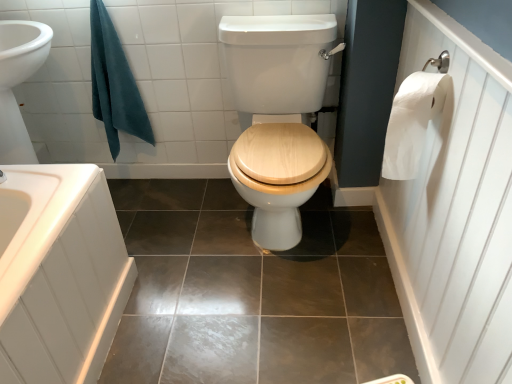
In order to face shiny brown tile at center, should I rotate leftwards or rightwards?

A 4.772 degree turn to the left will do.

The height and width of the screenshot is (384, 512). I want to click on white paper towel at right, so click(455, 211).

Describe the element at coordinates (455, 211) in the screenshot. I see `white paper towel at right` at that location.

You are a GUI agent. You are given a task and a screenshot of the screen. Output one action in this format:
    pyautogui.click(x=<x>, y=<y>)
    Task: Click on the shiny brown tile at center
    The width and height of the screenshot is (512, 384).
    Given the screenshot: What is the action you would take?
    pyautogui.click(x=251, y=293)

Is white paper towel at right facing towards shiny brown tile at center?

Yes.

Considering the sizes of objects white paper towel at right and shiny brown tile at center in the image provided, who is taller, white paper towel at right or shiny brown tile at center?

white paper towel at right is taller.

This screenshot has width=512, height=384. Identify the location of ceramic tile below the white paper towel at right (from the image's perspective). (251, 293).

Considering the points (446, 343) and (332, 325), which point is behind, point (446, 343) or point (332, 325)?

The point (332, 325) is farther from the camera.

What's the angular difference between white paper towel at right and teal cotton towel at upper left's facing directions?

90 degrees separate the facing orientations of white paper towel at right and teal cotton towel at upper left.

Considering the relative sizes of white paper towel at right and teal cotton towel at upper left in the image provided, is white paper towel at right taller than teal cotton towel at upper left?

Indeed, white paper towel at right has a greater height compared to teal cotton towel at upper left.

Measure the distance between white paper towel at right and teal cotton towel at upper left.

4.25 feet.

From the image's perspective, does white paper towel at right appear higher than teal cotton towel at upper left?

No.

Considering the sizes of objects teal cotton towel at upper left and shiny brown tile at center in the image provided, who is bigger, teal cotton towel at upper left or shiny brown tile at center?

shiny brown tile at center is bigger.

Considering the positions of points (117, 141) and (195, 197), is point (117, 141) closer to camera compared to point (195, 197)?

Yes, point (117, 141) is closer to viewer.

Does teal cotton towel at upper left touch shiny brown tile at center?

No, teal cotton towel at upper left is not touching shiny brown tile at center.

Is white wood toilet seat at center shorter than white paper at right?

No.

Is white wood toilet seat at center with white paper at right?

There is a gap between white wood toilet seat at center and white paper at right.

The image size is (512, 384). In order to click on toilet paper above the white wood toilet seat at center (from the image's perspective) in this screenshot , I will do `click(412, 123)`.

Is white wood toilet seat at center far from white paper towel at right?

No.

Between white wood toilet seat at center and white paper towel at right, which one is positioned in front?

Positioned in front is white paper towel at right.

Can you confirm if white wood toilet seat at center is thinner than white paper towel at right?

No.

How many degrees apart are the facing directions of white wood toilet seat at center and white paper towel at right?

90 degrees.

Considering the positions of objects white paper at right and teal cotton towel at upper left in the image provided, who is more to the left, white paper at right or teal cotton towel at upper left?

teal cotton towel at upper left is more to the left.

From a real-world perspective, between white paper at right and teal cotton towel at upper left, who is vertically higher?

white paper at right is physically above.

Is white paper at right next to teal cotton towel at upper left and touching it?

No, white paper at right is not touching teal cotton towel at upper left.

Is there a large distance between white wood toilet seat at center and shiny brown tile at center?

No.

Which is behind, point (255, 48) or point (138, 180)?

The point (138, 180) is more distant.

Is white wood toilet seat at center looking in the opposite direction of shiny brown tile at center?

white wood toilet seat at center is not turned away from shiny brown tile at center.

At what (x,y) coordinates should I click in order to perform the action: click on side in front of the shiny brown tile at center. Please return your answer as a coordinate pair (x, y). This screenshot has width=512, height=384. Looking at the image, I should click on (455, 211).

You are a GUI agent. You are given a task and a screenshot of the screen. Output one action in this format:
    pyautogui.click(x=<x>, y=<y>)
    Task: Click on the bath towel above the white paper towel at right (from the image's perspective)
    
    Given the screenshot: What is the action you would take?
    (114, 83)

When comparing their distances from white paper at right, does white paper towel at right or teal cotton towel at upper left seem further?

Based on the image, teal cotton towel at upper left appears to be further to white paper at right.

Looking at the image, which one is located further to white wood toilet seat at center, white paper at right or shiny brown tile at center?

white paper at right is further to white wood toilet seat at center.

Estimate the real-world distances between objects in this image. Which object is closer to shiny brown tile at center, white wood toilet seat at center or teal cotton towel at upper left?

white wood toilet seat at center.

Estimate the real-world distances between objects in this image. Which object is closer to white paper towel at right, shiny brown tile at center or white paper at right?

white paper at right lies closer to white paper towel at right than the other object.

From the image, which object appears to be nearer to white wood toilet seat at center, shiny brown tile at center or teal cotton towel at upper left?

shiny brown tile at center.

Which object lies nearer to the anchor point teal cotton towel at upper left, white paper towel at right or white wood toilet seat at center?

white wood toilet seat at center lies closer to teal cotton towel at upper left than the other object.

Estimate the real-world distances between objects in this image. Which object is further from teal cotton towel at upper left, shiny brown tile at center or white paper towel at right?

The object further to teal cotton towel at upper left is white paper towel at right.

Looking at this image, when comparing their distances from white wood toilet seat at center, does teal cotton towel at upper left or white paper towel at right seem further?

Based on the image, teal cotton towel at upper left appears to be further to white wood toilet seat at center.

Where is `ceramic tile between teal cotton towel at upper left and white paper at right from left to right`? This screenshot has height=384, width=512. ceramic tile between teal cotton towel at upper left and white paper at right from left to right is located at coordinates (251, 293).

I want to click on sit between shiny brown tile at center and white paper at right, so click(x=278, y=116).

Where is `sit between teal cotton towel at upper left and white paper towel at right in the horizontal direction`? The height and width of the screenshot is (384, 512). sit between teal cotton towel at upper left and white paper towel at right in the horizontal direction is located at coordinates (278, 116).

Locate an element on the screen. The height and width of the screenshot is (384, 512). toilet paper located between teal cotton towel at upper left and white paper towel at right in the left-right direction is located at coordinates (412, 123).